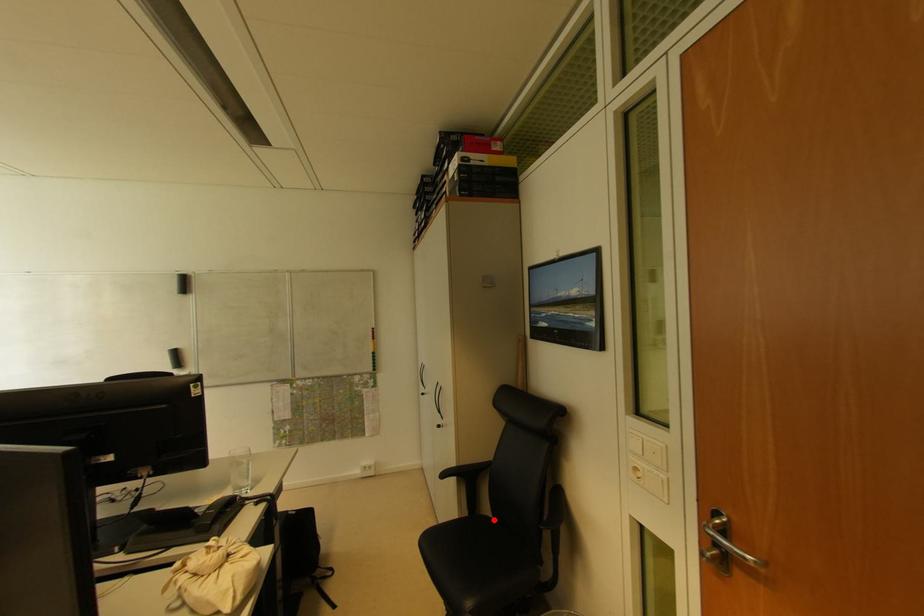
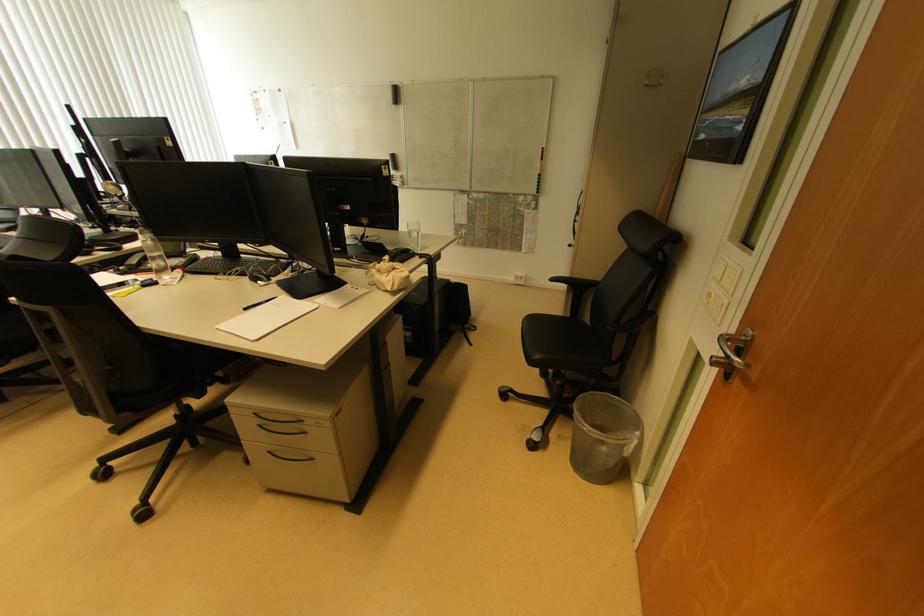
Find the pixel in the second image that matches the highlighted location in the first image.

(590, 328)